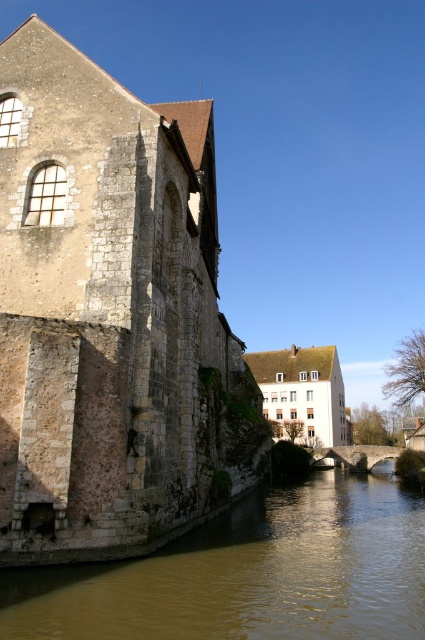
Is point (130, 401) behind point (221, 524)?

No, it is in front of (221, 524).

Is stone wall at left bigger than brown stone river at lower left?

Indeed, stone wall at left has a larger size compared to brown stone river at lower left.

The width and height of the screenshot is (425, 640). Identify the location of stone wall at left. (110, 316).